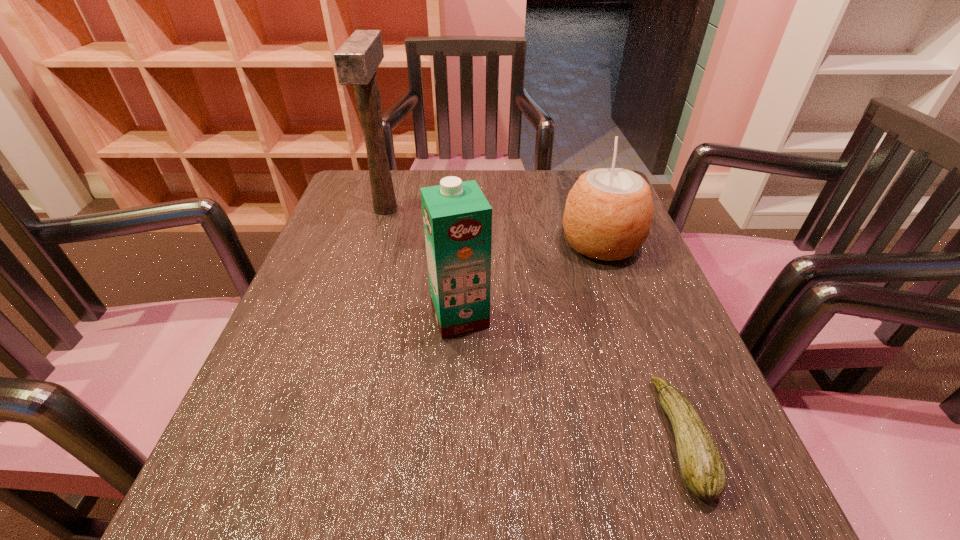
At what (x,y) coordinates should I click in order to perform the action: click on the tallest object. Please return your answer as a coordinate pair (x, y). The width and height of the screenshot is (960, 540). Looking at the image, I should click on (356, 61).

This screenshot has width=960, height=540. What are the coordinates of `mallet` in the screenshot? It's located at 356,61.

This screenshot has width=960, height=540. What are the coordinates of `carton` in the screenshot? It's located at (457, 218).

I want to click on the third shortest object, so click(x=457, y=218).

Where is `coconut`? This screenshot has width=960, height=540. coconut is located at coordinates (608, 213).

At what (x,y) coordinates should I click in order to perform the action: click on zucchini. Please return your answer as a coordinate pair (x, y). Looking at the image, I should click on (702, 468).

Locate an element on the screen. The width and height of the screenshot is (960, 540). the shortest object is located at coordinates (702, 468).

You are a GUI agent. You are given a task and a screenshot of the screen. Output one action in this format:
    pyautogui.click(x=<x>, y=<y>)
    Task: Click on the vacant area situated on the left of the leftmost object
    
    Given the screenshot: What is the action you would take?
    pyautogui.click(x=349, y=209)

Find the location of a particular element. This screenshot has width=960, height=540. vacant space located 0.070m on the front of the second nearest object is located at coordinates (457, 371).

In order to click on vacant space located on the back of the third tallest object in this screenshot , I will do `click(589, 210)`.